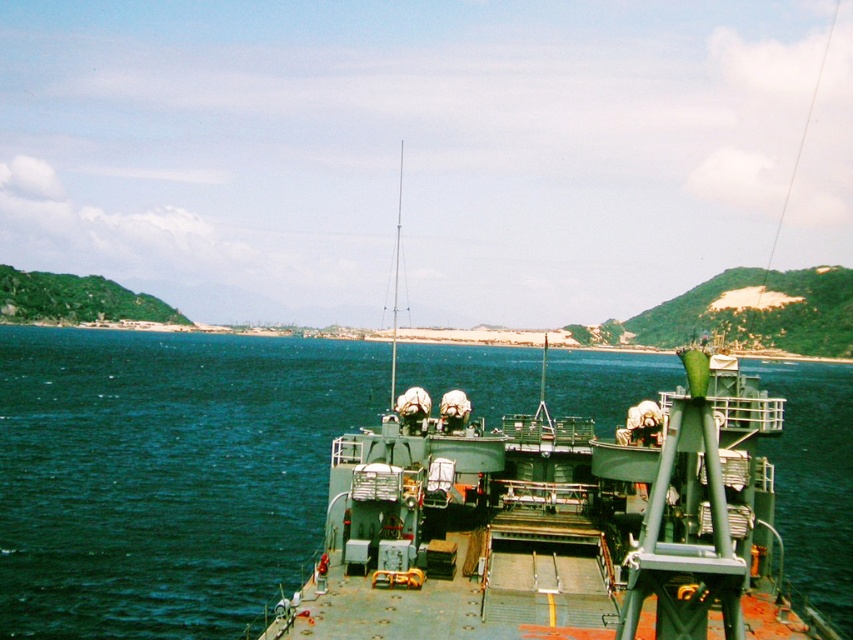
Question: Is blue water at center wider than green matte boat at center?

Choices:
 (A) no
 (B) yes

Answer: (B)

Question: Is blue water at center closer to camera compared to green matte boat at center?

Choices:
 (A) no
 (B) yes

Answer: (A)

Question: Which of the following is the closest to the observer?

Choices:
 (A) pos(78,593)
 (B) pos(509,528)

Answer: (B)

Question: Does blue water at center have a smaller size compared to green matte boat at center?

Choices:
 (A) yes
 (B) no

Answer: (B)